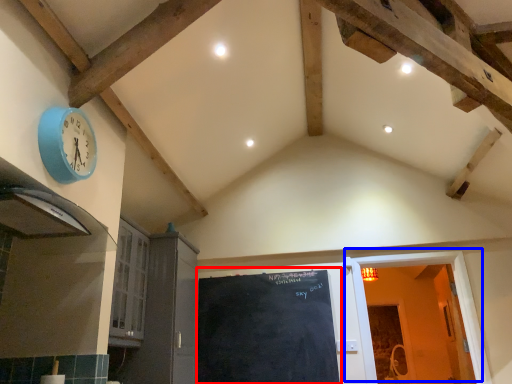
Question: Which of the following is the farthest to the observer, bulletin board (highlighted by a red box) or door (highlighted by a blue box)?

Choices:
 (A) bulletin board
 (B) door

Answer: (A)